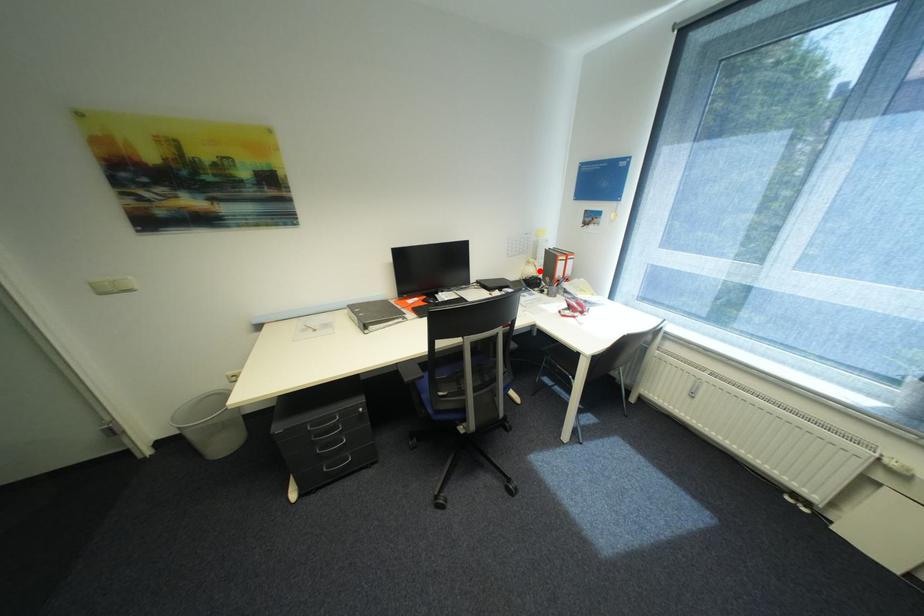
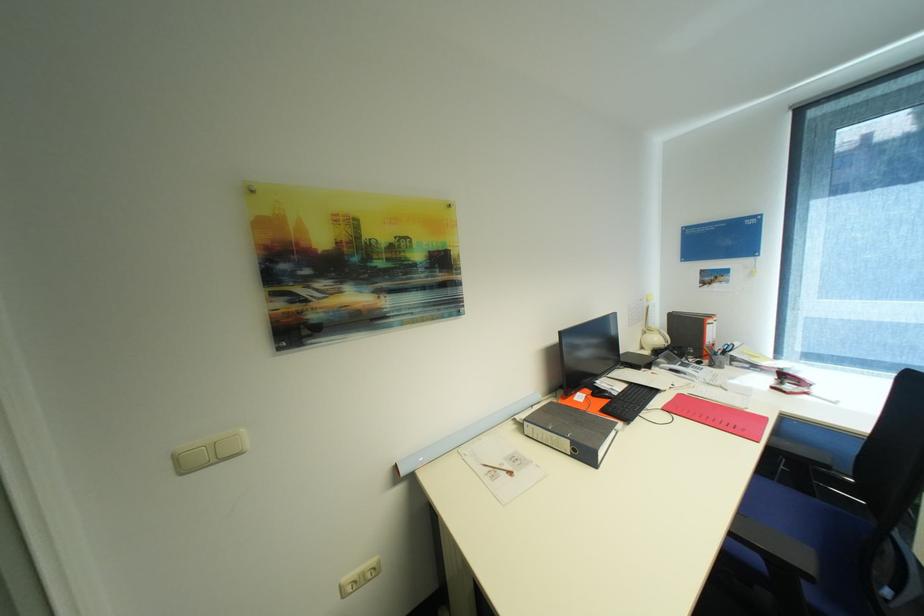
Question: I am providing you with two images of the same scene from different viewpoints. A red point is marked on the first image. Is the red point's position out of view in image 2?

Choices:
 (A) Yes
 (B) No

Answer: (B)